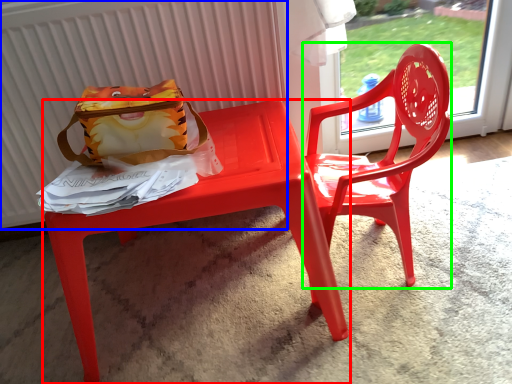
Question: Which object is the farthest from table (highlighted by a red box)? Choose among these: radiator (highlighted by a blue box) or chair (highlighted by a green box).

Choices:
 (A) radiator
 (B) chair

Answer: (A)